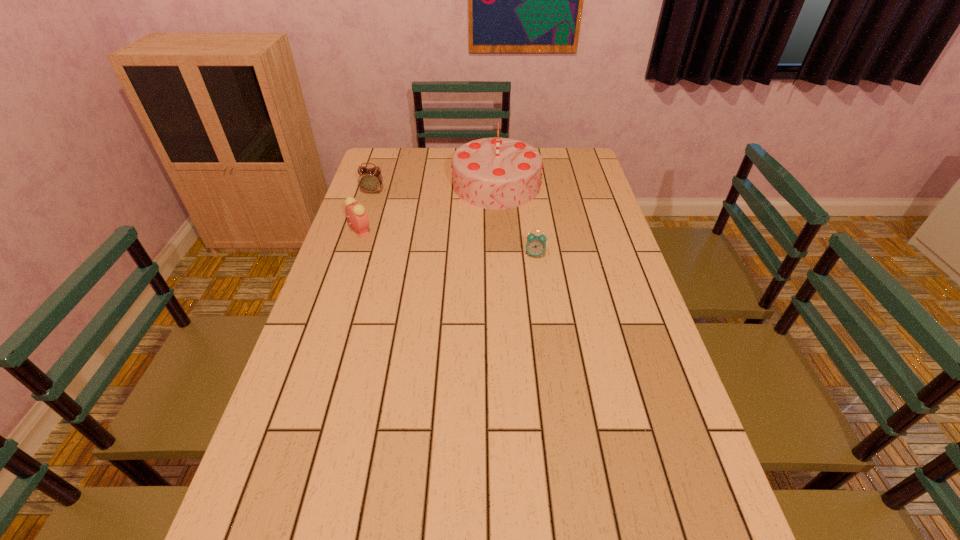
Locate an element on the screen. Image resolution: width=960 pixels, height=540 pixels. the tallest object is located at coordinates (496, 173).

The image size is (960, 540). I want to click on the farthest alarm clock, so click(x=370, y=180).

Identify the location of the third farthest object. (355, 212).

This screenshot has width=960, height=540. In order to click on the nearest alarm clock in this screenshot , I will do `click(536, 245)`.

You are a GUI agent. You are given a task and a screenshot of the screen. Output one action in this format:
    pyautogui.click(x=<x>, y=<y>)
    Task: Click on the rightmost alarm clock
    
    Given the screenshot: What is the action you would take?
    pyautogui.click(x=536, y=245)

At what (x,y) coordinates should I click in order to perform the action: click on vacant space situated on the left of the tallest object. Please return your answer as a coordinate pair (x, y). This screenshot has width=960, height=540. Looking at the image, I should click on (367, 185).

Identify the location of free spot located 0.110m on the face of the farthest alarm clock. This screenshot has width=960, height=540. (367, 212).

Find the location of `free region located on the face of the third farthest object`. free region located on the face of the third farthest object is located at coordinates (455, 231).

What are the coordinates of `free space located on the face of the shortest object` in the screenshot? It's located at (540, 289).

Where is `object at the far edge`? This screenshot has width=960, height=540. object at the far edge is located at coordinates (496, 173).